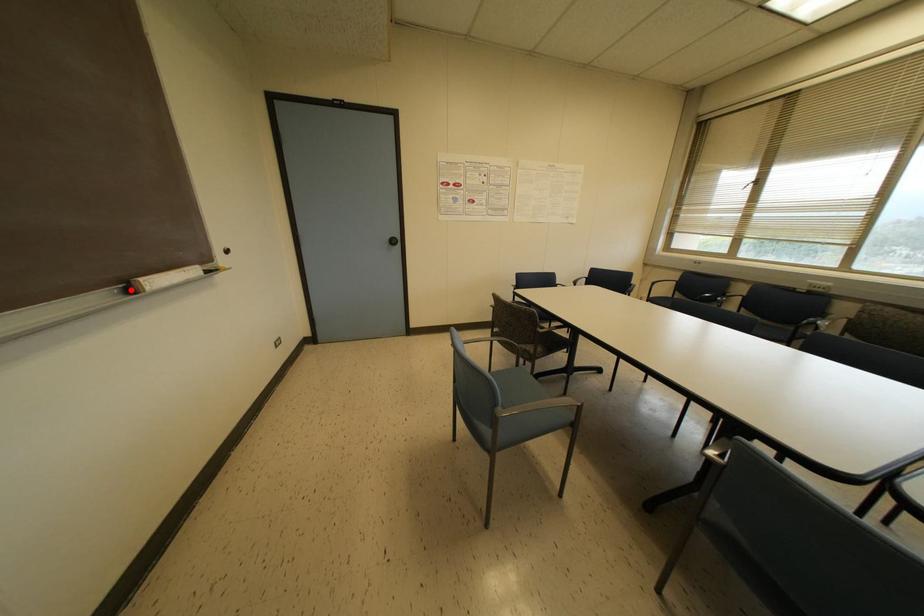
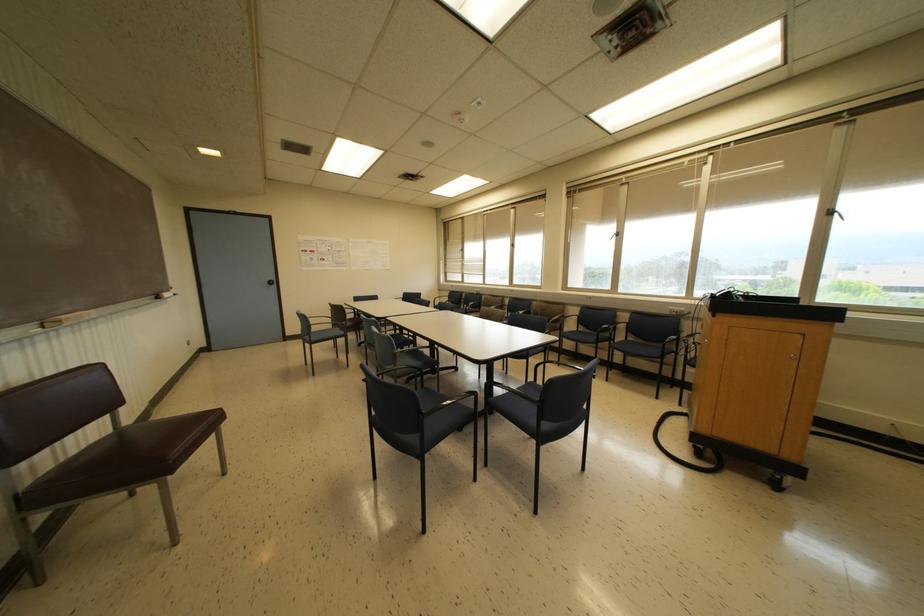
The point at the highlighted location is marked in the first image. Where is the corresponding point in the second image?

(157, 297)